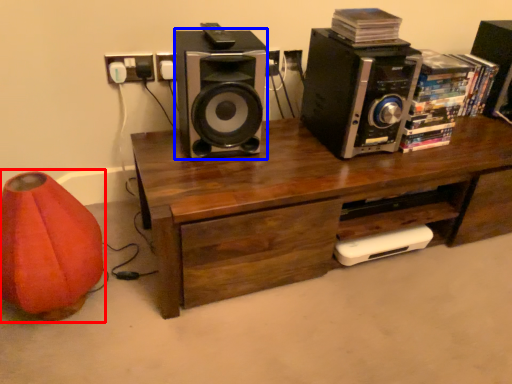
Question: Which of the following is the closest to the observer, bean bag chair (highlighted by a red box) or speaker (highlighted by a blue box)?

Choices:
 (A) bean bag chair
 (B) speaker

Answer: (A)